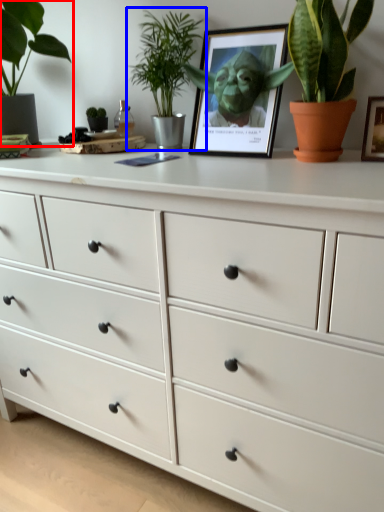
Question: Which object is closer to the camera taking this photo, houseplant (highlighted by a red box) or houseplant (highlighted by a blue box)?

Choices:
 (A) houseplant
 (B) houseplant

Answer: (A)